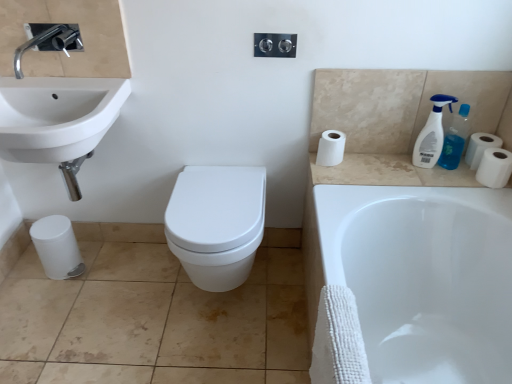
I want to click on empty space that is ontop of beige tile at lower left (from a real-world perspective), so click(135, 307).